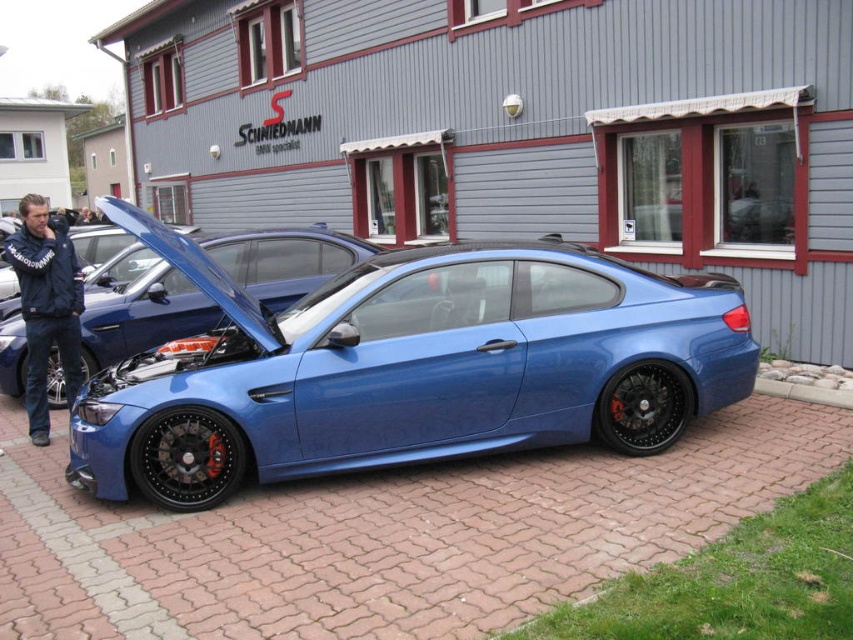
You are standing at the entrance of the building with the name SCHNIEDMANN. You want to walk directly towards the metallic blue sports car at center. Which direction should you walk? Please answer with either north, south, east, or west.

The metallic blue sports car at center is located at point coordinates (421, 372). Since the car is at the center of the image, you should walk directly towards it by moving forward from the entrance. However, without additional information about the image orientation, it is impossible to determine the exact cardinal direction. Please provide more details about the image orientation or landmarks to determine the direction accurately.

You are a delivery person who needs to load a blue fabric jacket at left into the trunk of the metallic blue sports car at center. Can the jacket fit vertically inside the trunk without folding it?

The metallic blue sports car at center has a lesser height compared to blue fabric jacket at left, so the jacket cannot fit vertically in the trunk without folding.

You are standing in front of the building and want to pick up the blue fabric jacket at left. Do you need to walk around the satin blue car at center to reach it?

The satin blue car at center is further to the viewer than the blue fabric jacket at left, so you do not need to walk around the car to reach the jacket. It is closer to you and accessible without moving the car.